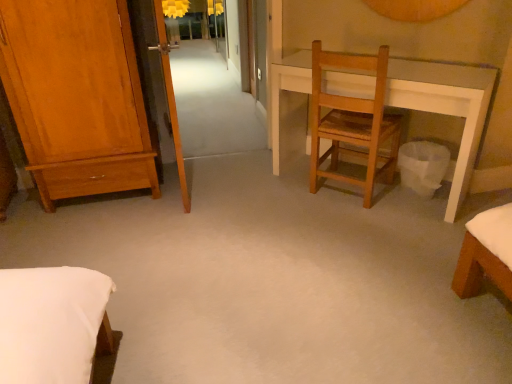
Identify the location of free space to the left of wooden chair at center. (286, 201).